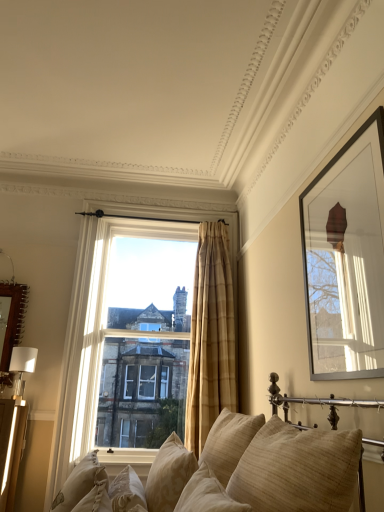
The width and height of the screenshot is (384, 512). What do you see at coordinates (77, 483) in the screenshot? I see `beige textured pillow at lower left, the first pillow when ordered from left to right` at bounding box center [77, 483].

How much space does beige textured pillow at lower center, which ranks as the 2th pillow in left-to-right order, occupy horizontally?

beige textured pillow at lower center, which ranks as the 2th pillow in left-to-right order, is 9.01 inches wide.

At what (x,y) coordinates should I click in order to perform the action: click on wooden mirror at left, which is counted as the second picture frame, starting from the right. Please return your answer as a coordinate pair (x, y). Looking at the image, I should click on (11, 322).

Image resolution: width=384 pixels, height=512 pixels. Identify the location of beige textured pillow at lower left, the first pillow when ordered from left to right. (77, 483).

How different are the orientations of beige textured pillow at lower center, which is the 5th pillow in right-to-left order, and clear glass window at center in degrees?

93.8 degrees separate the facing orientations of beige textured pillow at lower center, which is the 5th pillow in right-to-left order, and clear glass window at center.

Based on the photo, who is more distant, beige textured pillow at lower center, which is the 5th pillow in right-to-left order, or clear glass window at center?

clear glass window at center is further from the camera.

Is beige textured pillow at lower center, which is the 5th pillow in right-to-left order, thinner than clear glass window at center?

Indeed, beige textured pillow at lower center, which is the 5th pillow in right-to-left order, has a lesser width compared to clear glass window at center.

Considering the relative positions of beige textured pillow at lower center, which appears as the 6th pillow when viewed from the left, and beige textured pillow at lower center, acting as the 4th pillow starting from the right, in the image provided, is beige textured pillow at lower center, which appears as the 6th pillow when viewed from the left, to the right of beige textured pillow at lower center, acting as the 4th pillow starting from the right, from the viewer's perspective?

Yes.

Which is behind, beige textured pillow at lower center, which appears as the 6th pillow when viewed from the left, or beige textured pillow at lower center, acting as the 4th pillow starting from the right?

beige textured pillow at lower center, acting as the 4th pillow starting from the right.

In the scene shown: Considering the relative sizes of beige textured pillow at lower center, the 1th pillow viewed from the right, and beige textured pillow at lower center, which is the 3th pillow from left to right, in the image provided, is beige textured pillow at lower center, the 1th pillow viewed from the right, wider than beige textured pillow at lower center, which is the 3th pillow from left to right,?

Yes, beige textured pillow at lower center, the 1th pillow viewed from the right, is wider than beige textured pillow at lower center, which is the 3th pillow from left to right.

From a real-world perspective, is beige textured pillow at lower center, the 1th pillow viewed from the right, on beige textured pillow at lower center, acting as the 4th pillow starting from the right?

Yes, from a real-world perspective, beige textured pillow at lower center, the 1th pillow viewed from the right, is above beige textured pillow at lower center, acting as the 4th pillow starting from the right.

Consider the image. Is beige textured pillow at lower center, which is the 5th pillow in right-to-left order, situated inside white glossy table lamp at left or outside?

The correct answer is: outside.

Which pillow is the 2nd one when counting from the right side of the white glossy table lamp at left? Please provide its 2D coordinates.

[(127, 490)]

Considering the relative positions of beige textured pillow at lower center, which is the 5th pillow in right-to-left order, and white glossy table lamp at left in the image provided, is beige textured pillow at lower center, which is the 5th pillow in right-to-left order, to the left of white glossy table lamp at left from the viewer's perspective?

In fact, beige textured pillow at lower center, which is the 5th pillow in right-to-left order, is to the right of white glossy table lamp at left.

From the image's perspective, relative to beige fabric couch at center, is clear glass window at center above or below?

clear glass window at center is above beige fabric couch at center.

In the image, there is a clear glass window at center. Identify the location of studio couch below it (from a real-world perspective). (258, 469).

Is clear glass window at center positioned with its back to beige fabric couch at center?

No, clear glass window at center is not facing the opposite direction of beige fabric couch at center.

Considering the positions of objects matte black picture frame at upper right, marked as the first picture frame in a front-to-back arrangement, and white glossy table lamp at left in the image provided, who is more to the right, matte black picture frame at upper right, marked as the first picture frame in a front-to-back arrangement, or white glossy table lamp at left?

Positioned to the right is matte black picture frame at upper right, marked as the first picture frame in a front-to-back arrangement.

Between matte black picture frame at upper right, the 1th picture frame viewed from the right, and white glossy table lamp at left, which one has less height?

Standing shorter between the two is white glossy table lamp at left.

Is matte black picture frame at upper right, marked as the first picture frame in a front-to-back arrangement, spatially inside white glossy table lamp at left, or outside of it?

matte black picture frame at upper right, marked as the first picture frame in a front-to-back arrangement, is located beyond the bounds of white glossy table lamp at left.

Considering the positions of objects matte black picture frame at upper right, the 1th picture frame viewed from the right, and white glossy table lamp at left in the image provided, who is in front, matte black picture frame at upper right, the 1th picture frame viewed from the right, or white glossy table lamp at left?

matte black picture frame at upper right, the 1th picture frame viewed from the right, is in front.

Considering the relative sizes of beige textured pillow at lower center, the 1th pillow viewed from the right, and beige textured pillow at lower center, which ranks as the 2th pillow in left-to-right order, in the image provided, is beige textured pillow at lower center, the 1th pillow viewed from the right, bigger than beige textured pillow at lower center, which ranks as the 2th pillow in left-to-right order,?

Yes.

Which object is further away from the camera, beige textured pillow at lower center, which appears as the 6th pillow when viewed from the left, or beige textured pillow at lower center, which ranks as the 2th pillow in left-to-right order?

Positioned behind is beige textured pillow at lower center, which ranks as the 2th pillow in left-to-right order.

Considering the positions of objects beige textured pillow at lower center, which appears as the 6th pillow when viewed from the left, and beige textured pillow at lower center, which ranks as the 2th pillow in left-to-right order, in the image provided, who is more to the right, beige textured pillow at lower center, which appears as the 6th pillow when viewed from the left, or beige textured pillow at lower center, which ranks as the 2th pillow in left-to-right order,?

beige textured pillow at lower center, which appears as the 6th pillow when viewed from the left.

Is beige textured pillow at lower left, the first pillow when ordered from left to right, aimed at beige textured pillow at center, the 2th pillow viewed from the right?

No.

From a real-world perspective, which is physically above, beige textured pillow at lower left, the first pillow when ordered from left to right, or beige textured pillow at center, the 2th pillow viewed from the right?

From a 3D spatial view, beige textured pillow at center, the 2th pillow viewed from the right, is above.

Based on the photo, who is smaller, beige textured pillow at lower left, the first pillow when ordered from left to right, or beige textured pillow at center, the 5th pillow when ordered from left to right?

beige textured pillow at lower left, the first pillow when ordered from left to right, is smaller.

Can you confirm if beige textured pillow at lower left, the first pillow when ordered from left to right, is positioned to the left of beige textured pillow at center, the 5th pillow when ordered from left to right?

Yes, beige textured pillow at lower left, the first pillow when ordered from left to right, is to the left of beige textured pillow at center, the 5th pillow when ordered from left to right.

At what (x,y) coordinates should I click in order to perform the action: click on pillow that is the 1st object to the right of the clear glass window at center, starting at the anchor. Please return your answer as a coordinate pair (x, y). Looking at the image, I should click on (127, 490).

Image resolution: width=384 pixels, height=512 pixels. What are the coordinates of `pillow that is the 3rd object directly below the beige textured pillow at lower center, which appears as the 6th pillow when viewed from the left (from a real-world perspective)` in the screenshot? It's located at (169, 475).

Based on their spatial positions, is beige textured pillow at center, the 2th pillow viewed from the right, or white glossy table lamp at left closer to clear glass window at center?

white glossy table lamp at left lies closer to clear glass window at center than the other object.

When comparing their distances from beige plaid curtain at center, does clear glass window at center or beige textured pillow at lower center, the 1th pillow viewed from the right, seem further?

beige textured pillow at lower center, the 1th pillow viewed from the right, is positioned further to the anchor beige plaid curtain at center.

Estimate the real-world distances between objects in this image. Which object is further from beige textured pillow at lower center, which is the 5th pillow in right-to-left order, wooden mirror at left, which is counted as the second picture frame, starting from the right, or beige textured pillow at lower center, which is the 3th pillow from left to right?

Based on the image, wooden mirror at left, which is counted as the second picture frame, starting from the right, appears to be further to beige textured pillow at lower center, which is the 5th pillow in right-to-left order.

Considering their positions, is beige textured pillow at lower center, which ranks as the 2th pillow in left-to-right order, positioned further to matte black picture frame at upper right, the 1th picture frame viewed from the right, than white glossy table lamp at left?

Among the two, white glossy table lamp at left is located further to matte black picture frame at upper right, the 1th picture frame viewed from the right.

Based on their spatial positions, is beige plaid curtain at center or beige textured pillow at lower center, which is the 3th pillow from left to right, closer to beige textured pillow at center, the 5th pillow when ordered from left to right?

beige textured pillow at lower center, which is the 3th pillow from left to right.

Which object lies nearer to the anchor point beige textured pillow at lower center, which ranks as the 2th pillow in left-to-right order, clear glass window at center or matte black picture frame at upper right, the 2th picture frame when ordered from left to right?

matte black picture frame at upper right, the 2th picture frame when ordered from left to right, is closer to beige textured pillow at lower center, which ranks as the 2th pillow in left-to-right order.

From the image, which object appears to be nearer to beige textured pillow at center, the 2th pillow viewed from the right, beige textured pillow at lower center, which ranks as the 3th pillow in right-to-left order, or beige textured pillow at lower center, which is the 3th pillow from left to right?

beige textured pillow at lower center, which is the 3th pillow from left to right.

From the image, which object appears to be farther from white glossy table lamp at left, beige plaid curtain at center or beige textured pillow at lower center, which is the 3th pillow from left to right?

beige textured pillow at lower center, which is the 3th pillow from left to right.

I want to click on table lamp between beige textured pillow at lower center, the 1th pillow viewed from the right, and wooden mirror at left, which is counted as the second picture frame, starting from the right, in the front-back direction, so click(x=22, y=367).

At what (x,y) coordinates should I click in order to perform the action: click on picture frame located between beige fabric couch at center and wooden mirror at left, acting as the 1th picture frame starting from the left, in the depth direction. Please return your answer as a coordinate pair (x, y). Image resolution: width=384 pixels, height=512 pixels. Looking at the image, I should click on (346, 257).

Locate an element on the screen. Image resolution: width=384 pixels, height=512 pixels. studio couch between beige textured pillow at lower left, the 6th pillow in the right-to-left sequence, and matte black picture frame at upper right, marked as the first picture frame in a front-to-back arrangement, in the horizontal direction is located at coordinates (258, 469).

Locate an element on the screen. This screenshot has width=384, height=512. curtain located between matte black picture frame at upper right, positioned as the second picture frame in back-to-front order, and clear glass window at center in the depth direction is located at coordinates (210, 337).